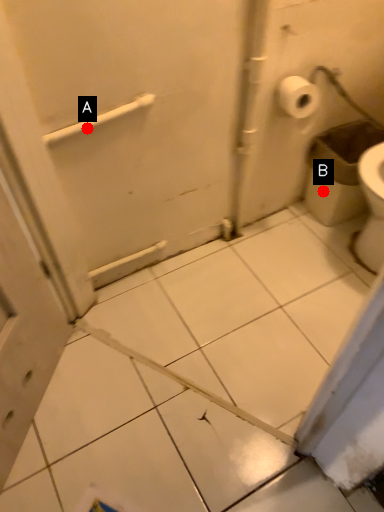
Question: Two points are circled on the image, labeled by A and B beside each circle. Which point is closer to the camera?

Choices:
 (A) A is closer
 (B) B is closer

Answer: (A)